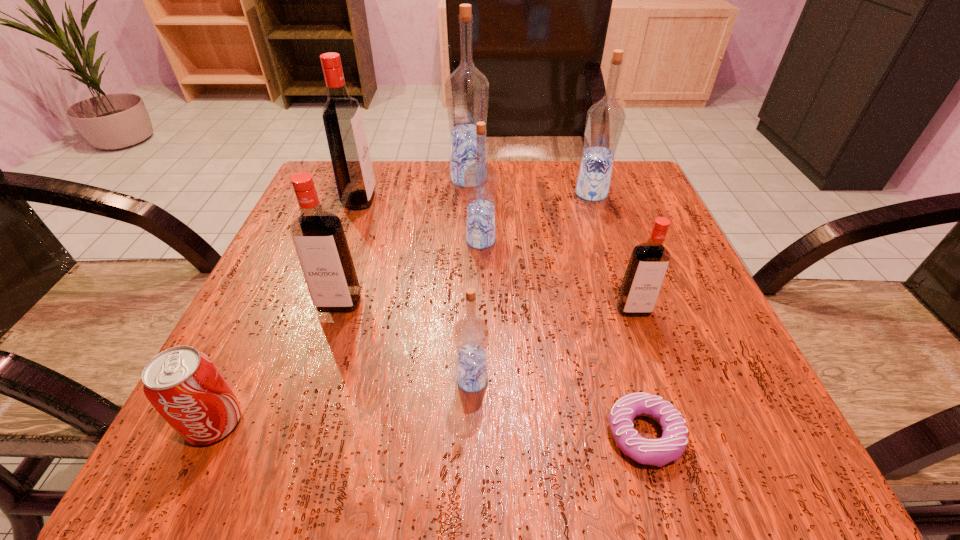
You are a GUI agent. You are given a task and a screenshot of the screen. Output one action in this format:
    pyautogui.click(x=<x>, y=<y>)
    Task: Click on the object that is at the near right corner
    This screenshot has height=540, width=960.
    Given the screenshot: What is the action you would take?
    pyautogui.click(x=658, y=452)

In the image, there is a desktop. Where is `vacant space at the far edge`? This screenshot has height=540, width=960. vacant space at the far edge is located at coordinates (501, 200).

In the image, there is a desktop. What are the coordinates of `vacant space at the near edge` in the screenshot? It's located at (601, 421).

In the image, there is a desktop. Identify the location of vacant space at the left edge. Image resolution: width=960 pixels, height=540 pixels. point(352,238).

At what (x,y) coordinates should I click in order to perform the action: click on free spot at the right edge of the desktop. Please return your answer as a coordinate pair (x, y). Looking at the image, I should click on (686, 308).

In the image, there is a desktop. At what (x,y) coordinates should I click in order to perform the action: click on vacant area at the far left corner. Please return your answer as a coordinate pair (x, y). Looking at the image, I should click on (333, 170).

The height and width of the screenshot is (540, 960). What are the coordinates of `blank area at the near left corner` in the screenshot? It's located at (236, 463).

The image size is (960, 540). I want to click on vacant space at the far right corner of the desktop, so click(x=575, y=174).

This screenshot has width=960, height=540. I want to click on free space between the second smallest red vodka and the doughnut, so click(492, 369).

You are a GUI agent. You are given a task and a screenshot of the screen. Output one action in this format:
    pyautogui.click(x=<x>, y=<y>)
    Task: Click on the free space between the rightmost red vodka and the leftmost object
    This screenshot has width=960, height=540.
    Given the screenshot: What is the action you would take?
    pyautogui.click(x=424, y=366)